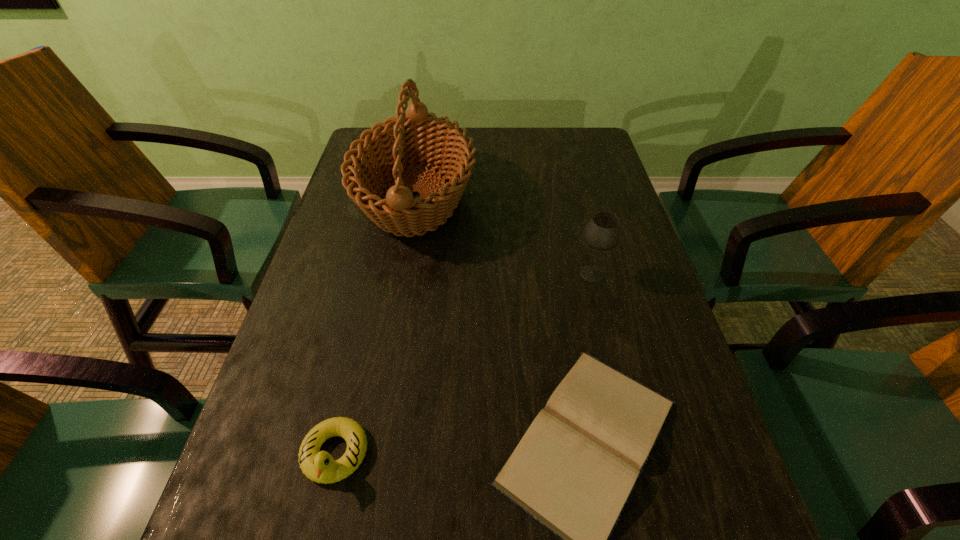
Image resolution: width=960 pixels, height=540 pixels. Identify the location of blank region between the second tallest object and the farthest object. (504, 236).

Image resolution: width=960 pixels, height=540 pixels. Find the location of `free spot between the farthest object and the second farthest object`. free spot between the farthest object and the second farthest object is located at coordinates (504, 236).

Identify the location of unoccupied position between the tallest object and the second tallest object. The width and height of the screenshot is (960, 540). (504, 236).

Locate which object ranks third in proximity to the second farthest object. Please provide its 2D coordinates. Your answer should be formatted as a tuple, i.e. [(x, y)], where the tuple contains the x and y coordinates of a point satisfying the conditions above.

[(319, 466)]

Locate which object ranks second in proximity to the third tallest object. Please provide its 2D coordinates. Your answer should be formatted as a tuple, i.e. [(x, y)], where the tuple contains the x and y coordinates of a point satisfying the conditions above.

[(398, 143)]